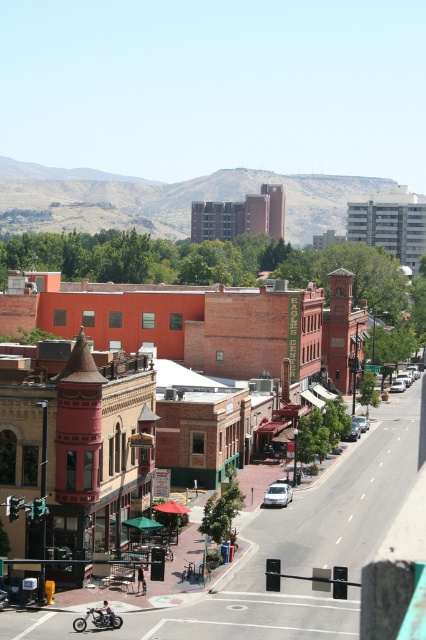
Question: Which of the following is the closest to the observer?

Choices:
 (A) brick building at center
 (B) satin silver sedan at center-right
 (C) shiny chrome motorcycle at lower left

Answer: (C)

Question: Does white matte car at center appear under white matte sedan at center-right?

Choices:
 (A) no
 (B) yes

Answer: (B)

Question: Which object appears farthest from the camera in this image?

Choices:
 (A) brick building at center
 (B) white matte car at center
 (C) white matte sedan at center-right
 (D) silver metallic sedan at center

Answer: (D)

Question: Is the position of shiny chrome motorcycle at lower left more distant than that of white matte car at center?

Choices:
 (A) no
 (B) yes

Answer: (A)

Question: Considering the real-world distances, which object is closest to the satin silver sedan at center-right?

Choices:
 (A) white matte car at center
 (B) silver metallic sedan at center
 (C) white matte sedan at center-right
 (D) brick building at center

Answer: (D)

Question: Does brick building at center appear under white matte sedan at center-right?

Choices:
 (A) yes
 (B) no

Answer: (B)